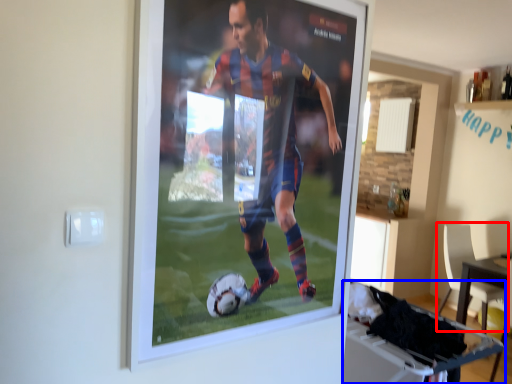
Question: Which of the following is the closest to the observer, chair (highlighted by a red box) or table (highlighted by a blue box)?

Choices:
 (A) chair
 (B) table

Answer: (B)